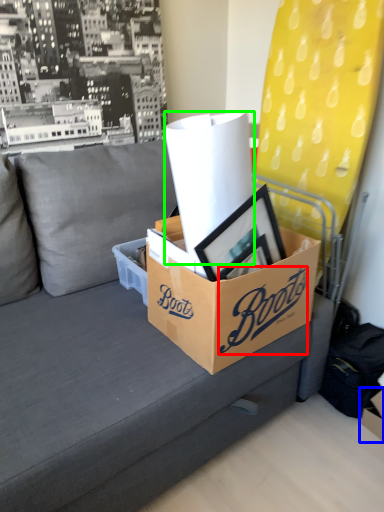
Question: Which is nearer to the writing (highlighted by a red box)? storage box (highlighted by a blue box) or paper towel (highlighted by a green box).

Choices:
 (A) storage box
 (B) paper towel

Answer: (B)